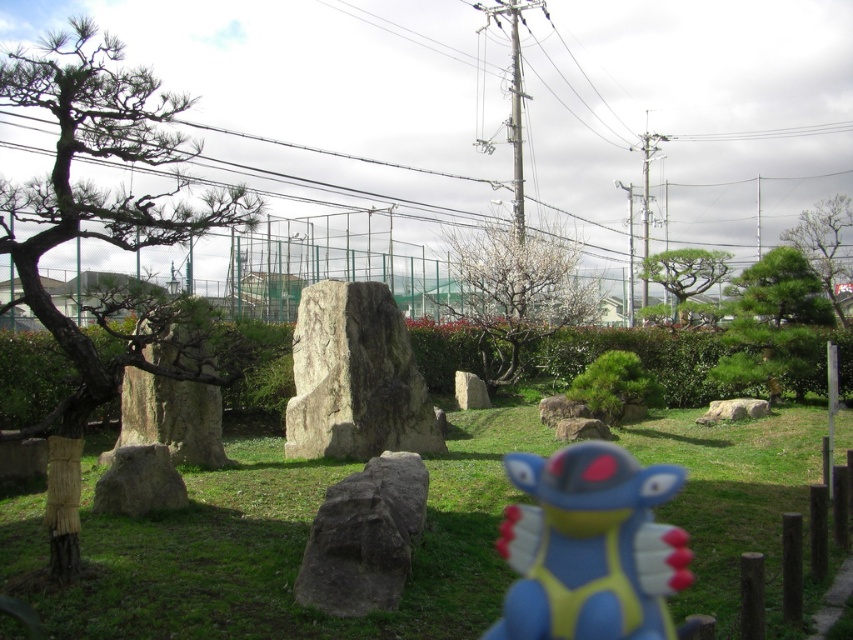
Which is behind, point (538, 496) or point (595, 305)?

The point (595, 305) is behind.

Is point (611, 580) positioned after point (498, 332)?

No.

Find the location of `blue rubber toy at center`. blue rubber toy at center is located at coordinates (590, 547).

Can you confirm if natural stone monument at center is bigger than green matte tree at upper right?

Correct, natural stone monument at center is larger in size than green matte tree at upper right.

Which is below, natural stone monument at center or green matte tree at upper right?

natural stone monument at center

Identify the location of natural stone monument at center. The height and width of the screenshot is (640, 853). (355, 378).

Which is more to the left, dark brown bark tree at left or green matte tree at upper right?

Positioned to the left is dark brown bark tree at left.

Which is more to the right, dark brown bark tree at left or green matte tree at upper right?

green matte tree at upper right

Where is `dark brown bark tree at left`? dark brown bark tree at left is located at coordinates (102, 236).